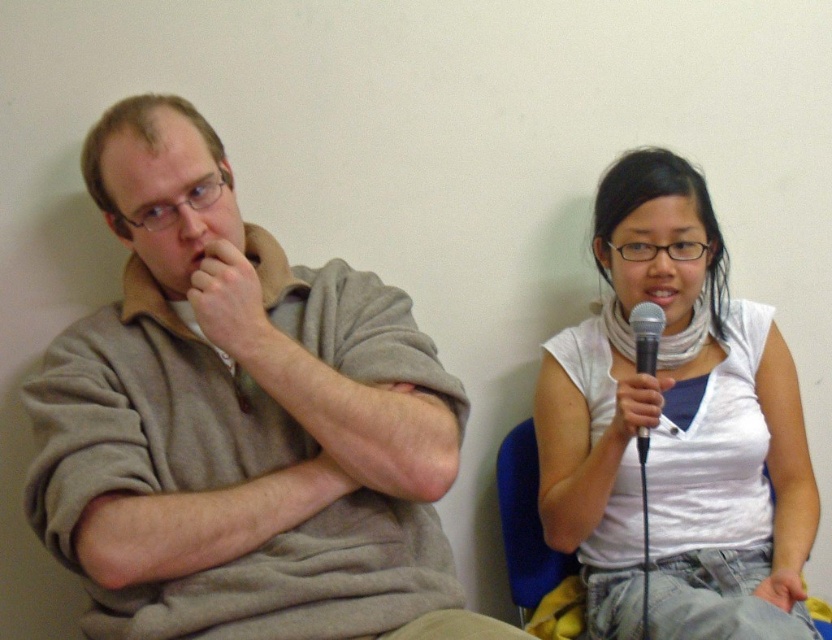
Question: Which of the following is the closest to the observer?

Choices:
 (A) white matte scarf at right
 (B) black metallic microphone at upper right
 (C) matte gray sweater at left

Answer: (C)

Question: Can you confirm if matte gray sweater at left is bigger than white matte scarf at right?

Choices:
 (A) no
 (B) yes

Answer: (A)

Question: Does matte gray sweater at left appear on the left side of black metallic microphone at upper right?

Choices:
 (A) no
 (B) yes

Answer: (B)

Question: Which point is closer to the camera?

Choices:
 (A) (632, 323)
 (B) (728, 388)

Answer: (A)

Question: Among these objects, which one is nearest to the camera?

Choices:
 (A) matte gray sweater at left
 (B) black metallic microphone at upper right
 (C) white matte scarf at right

Answer: (A)

Question: Does matte gray sweater at left have a greater width compared to white matte scarf at right?

Choices:
 (A) yes
 (B) no

Answer: (A)